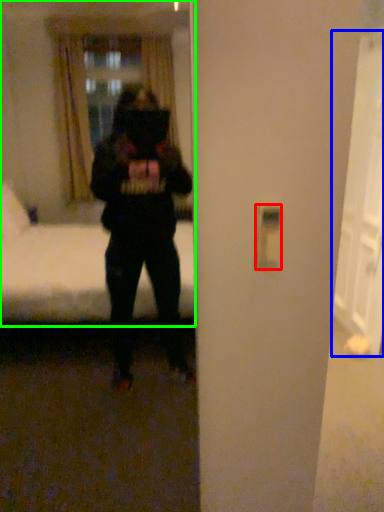
Question: Which object is the farthest from light switch (highlighted by a red box)? Choose among these: glass door (highlighted by a blue box) or mirror (highlighted by a green box).

Choices:
 (A) glass door
 (B) mirror

Answer: (B)